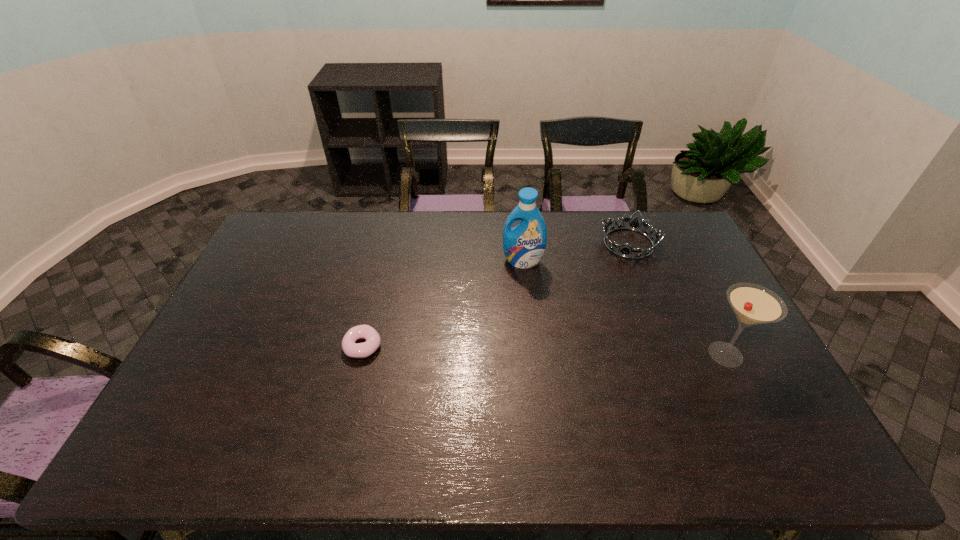
This screenshot has width=960, height=540. Find the location of `doughnut`. doughnut is located at coordinates (350, 348).

Where is `the leftmost object`? This screenshot has width=960, height=540. the leftmost object is located at coordinates (350, 348).

Image resolution: width=960 pixels, height=540 pixels. Identify the location of martini. (753, 304).

Where is `the third object from right to left`? the third object from right to left is located at coordinates (524, 245).

The height and width of the screenshot is (540, 960). I want to click on detergent, so click(x=524, y=245).

Locate an element on the screen. tiara is located at coordinates (634, 224).

Identify the location of free space located on the right of the doughnut. (475, 346).

The image size is (960, 540). What are the coordinates of `vacant space located 0.170m on the left of the martini` in the screenshot? It's located at (641, 354).

Locate an element on the screen. vacant region located 0.340m on the front-facing side of the detergent is located at coordinates (500, 345).

Identify the location of vacant area situated 0.300m on the front-facing side of the detergent. The height and width of the screenshot is (540, 960). (503, 334).